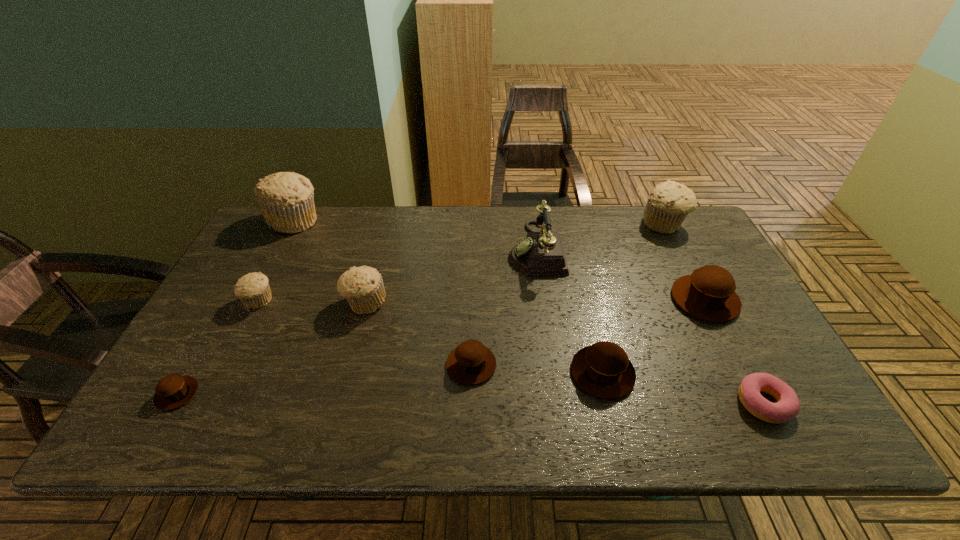
Where is `free spot at the far right corner of the desktop`? Image resolution: width=960 pixels, height=540 pixels. free spot at the far right corner of the desktop is located at coordinates (666, 245).

Identify the location of vacant area between the third brown muffin from left to right and the black telephone. (569, 311).

Identify the location of free spot between the biggest beige muffin and the smallest beige muffin. (276, 261).

The width and height of the screenshot is (960, 540). In order to click on vacant region between the third biggest beige muffin and the farthest brown muffin in this screenshot , I will do `click(535, 301)`.

Where is `vacant space that's between the doughnut and the smallest beige muffin`? vacant space that's between the doughnut and the smallest beige muffin is located at coordinates (512, 352).

Locate an element on the screen. The width and height of the screenshot is (960, 540). free area in between the telephone and the second smallest brown muffin is located at coordinates (503, 307).

Where is `vacant area that lies between the shortest muffin and the pink doughnut`? This screenshot has height=540, width=960. vacant area that lies between the shortest muffin and the pink doughnut is located at coordinates pyautogui.click(x=470, y=399).

In order to click on empty location between the fifth object from left to right and the fifth muffin from right to left in this screenshot , I will do `click(419, 334)`.

Identify the location of unoccupied position between the seventh object from right to left and the smallest brown muffin. 271,348.

Locate an element on the screen. This screenshot has height=540, width=960. blank region between the black telephone and the fifth object from left to right is located at coordinates (x=503, y=307).